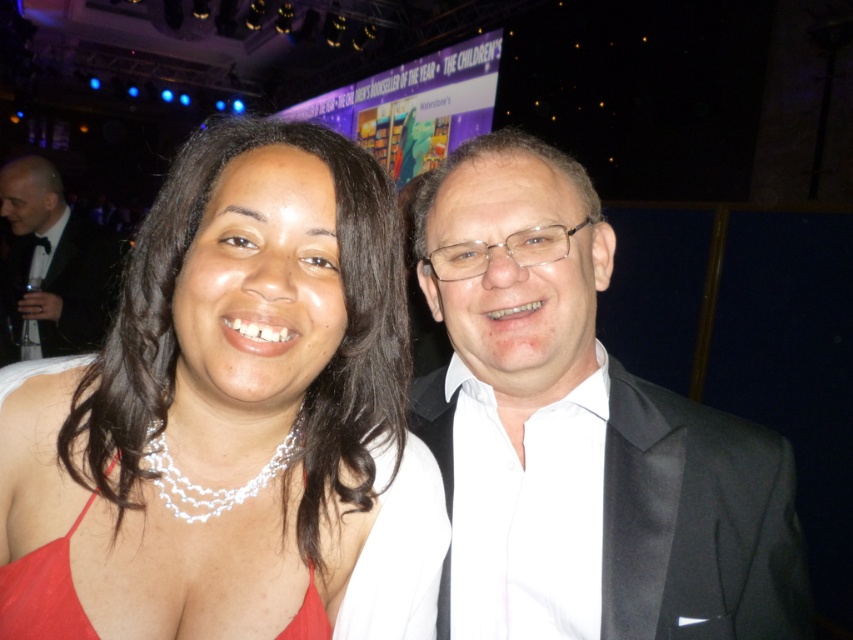
Based on the photo, between black satin suit at right and red satin dress at center, which one is positioned higher?

black satin suit at right is higher up.

This screenshot has height=640, width=853. Describe the element at coordinates (595, 413) in the screenshot. I see `black satin suit at right` at that location.

I want to click on black satin suit at right, so click(x=595, y=413).

Does matte red dress at center have a smaller size compared to black satin suit at right?

Actually, matte red dress at center might be larger than black satin suit at right.

Locate an element on the screen. matte red dress at center is located at coordinates (231, 419).

Can you confirm if matte red dress at center is smaller than black tuxedo at left?

Correct, matte red dress at center occupies less space than black tuxedo at left.

Does matte red dress at center have a greater height compared to black tuxedo at left?

No.

Which is in front, point (125, 481) or point (16, 198)?

Point (125, 481) is in front.

At what (x,y) coordinates should I click in order to perform the action: click on matte red dress at center. Please return your answer as a coordinate pair (x, y). Looking at the image, I should click on (231, 419).